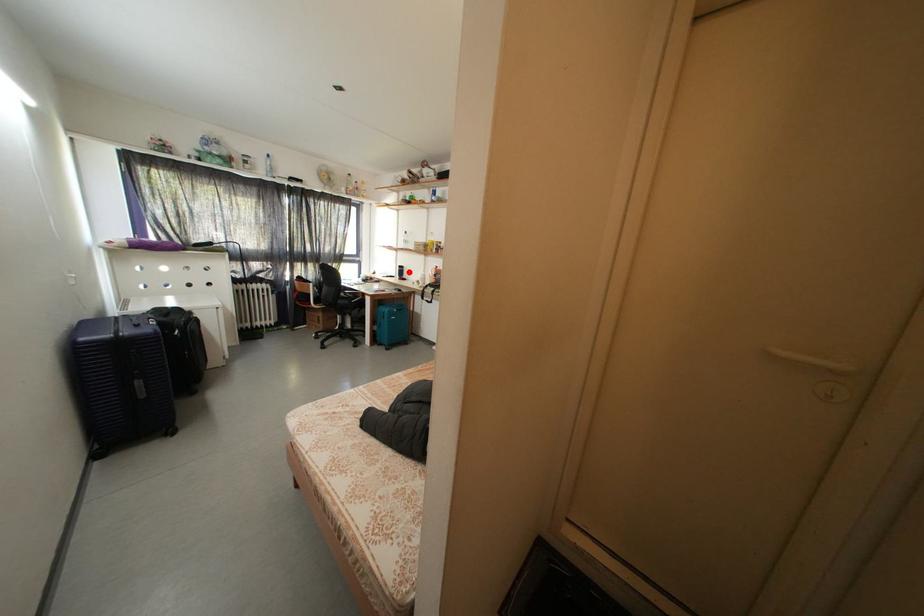
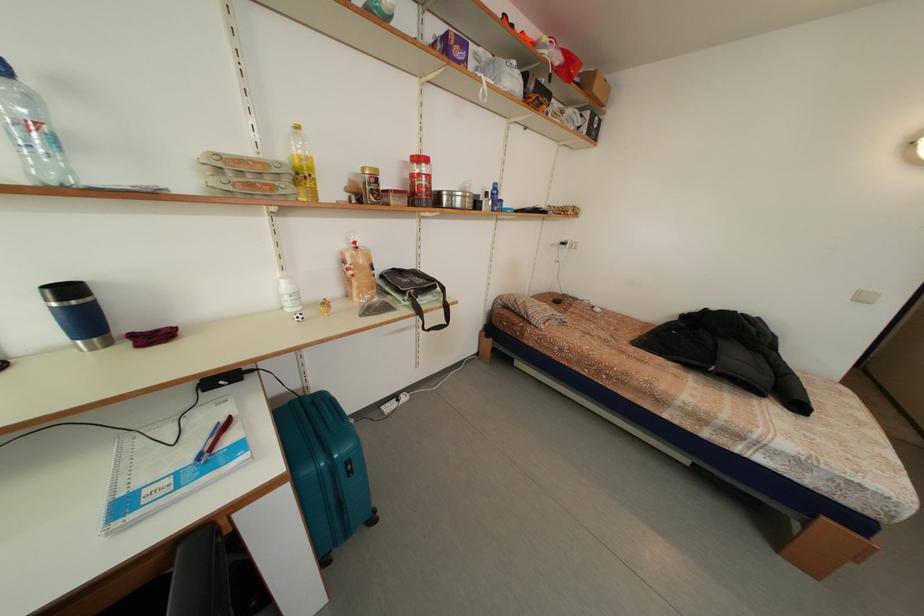
Question: I am providing you with two images of the same scene from different viewpoints. A red point is shown in image1. For the corresponding object point in image2, is it positioned nearer or farther from the camera?

Choices:
 (A) Nearer
 (B) Farther

Answer: (B)